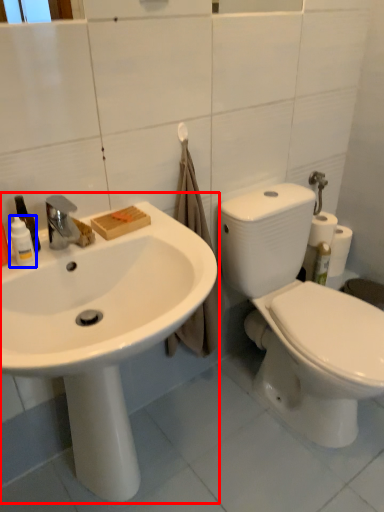
Question: Among these objects, which one is farthest to the camera, sink (highlighted by a red box) or toiletry (highlighted by a blue box)?

Choices:
 (A) sink
 (B) toiletry

Answer: (B)